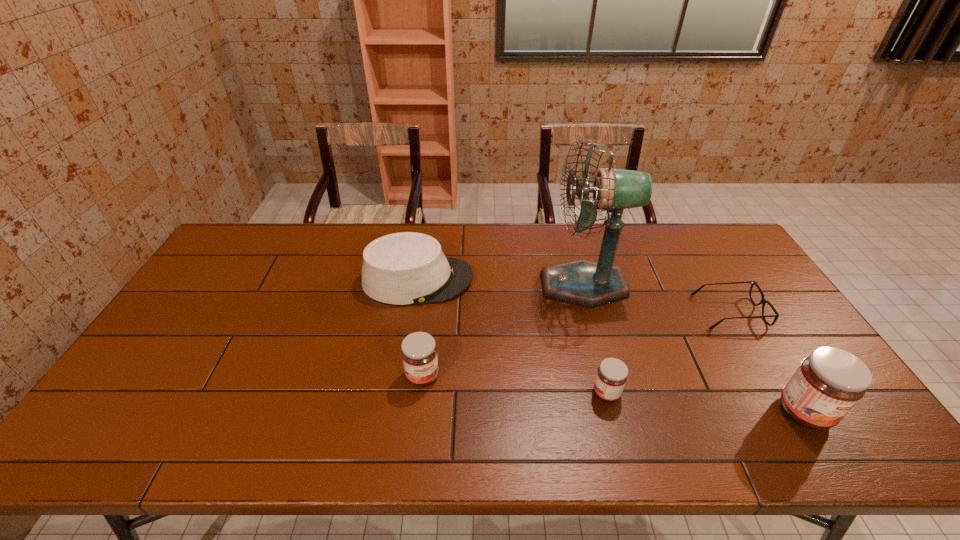
Identify the location of the second shortest jam. (419, 355).

Locate an element on the screen. the fifth tallest object is located at coordinates (612, 374).

Identify the location of the second jam from left to right. (612, 374).

Where is `the rightmost jam`? The image size is (960, 540). the rightmost jam is located at coordinates (830, 382).

At what (x,y) coordinates should I click in order to perform the action: click on the tallest jam. Please return your answer as a coordinate pair (x, y). The height and width of the screenshot is (540, 960). Looking at the image, I should click on (830, 382).

Locate an element on the screen. The image size is (960, 540). fan is located at coordinates (581, 282).

Find the location of `hat`. hat is located at coordinates (404, 268).

Find the location of `spectacles`. spectacles is located at coordinates (763, 301).

Where is `blank area located 0.320m on the left of the leftmost jam`? blank area located 0.320m on the left of the leftmost jam is located at coordinates coord(282,376).

Locate an element on the screen. vacant space located on the right of the shortest jam is located at coordinates (697, 393).